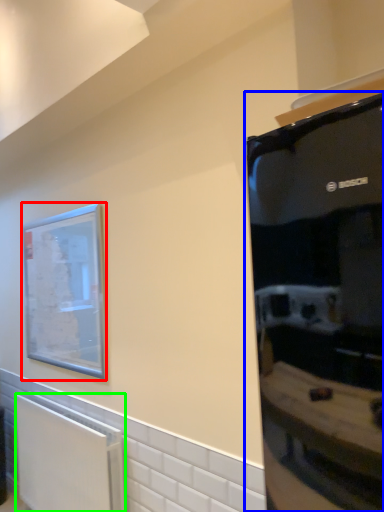
Question: Considering the real-world distances, which object is farthest from picture frame (highlighted by a red box)? appliance (highlighted by a blue box) or radiator (highlighted by a green box)?

Choices:
 (A) appliance
 (B) radiator

Answer: (A)